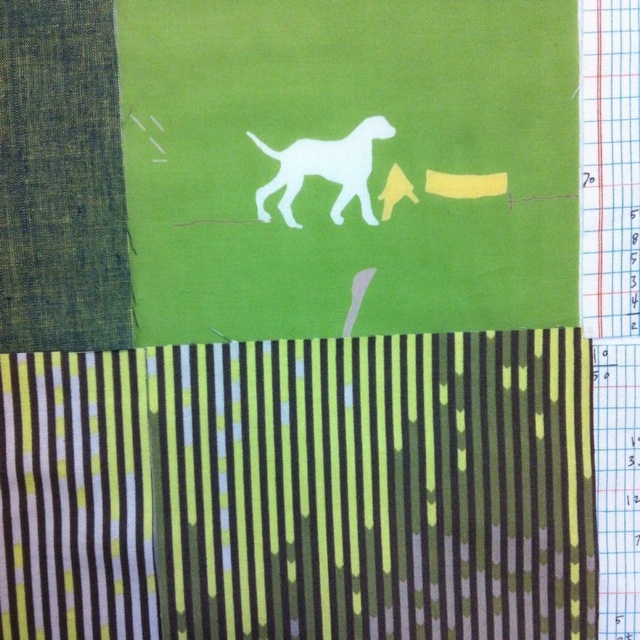
Question: Does green striped fabric at lower center appear on the right side of white paper dog at center?

Choices:
 (A) no
 (B) yes

Answer: (A)

Question: Where is green striped fabric at lower center located in relation to white paper dog at center in the image?

Choices:
 (A) below
 (B) above

Answer: (A)

Question: Which point appears farthest from the camera in this image?

Choices:
 (A) (132, 620)
 (B) (445, 173)
 (C) (323, 141)

Answer: (B)

Question: Which point is farther to the camera?

Choices:
 (A) green striped fabric at lower center
 (B) white paper dog at center

Answer: (A)

Question: Which is farther from the green striped fabric at lower center?

Choices:
 (A) white paper dog at center
 (B) white matte dog at center

Answer: (B)

Question: In this image, where is green striped fabric at lower center located relative to white paper dog at center?

Choices:
 (A) right
 (B) left

Answer: (B)